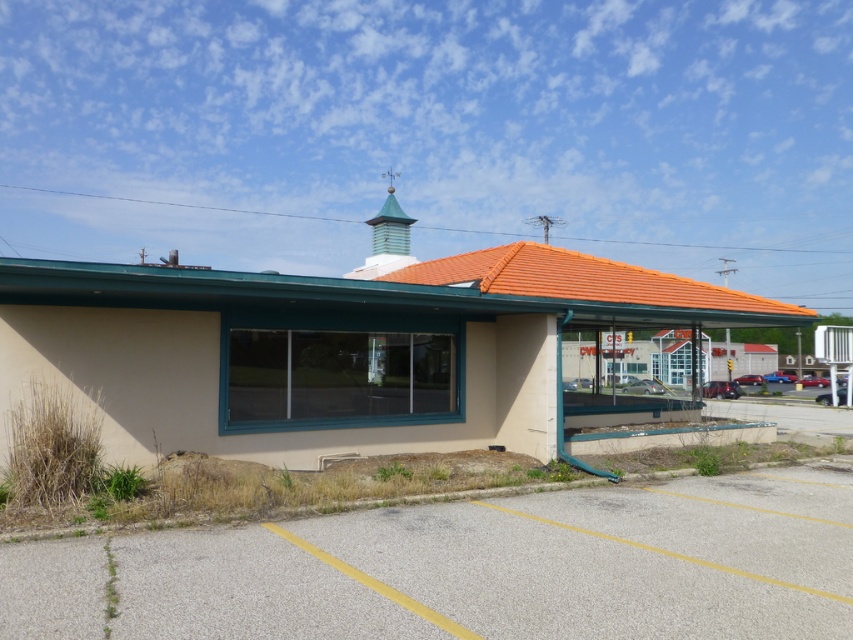
Question: Does metallic red car at lower right appear on the right side of metallic silver sedan at center?

Choices:
 (A) no
 (B) yes

Answer: (B)

Question: Does beige matte building at center have a lesser width compared to metallic red car at lower right?

Choices:
 (A) no
 (B) yes

Answer: (A)

Question: Which object is closer to the camera taking this photo?

Choices:
 (A) gray asphalt parking lot at lower left
 (B) shiny red sedan at center

Answer: (A)

Question: Which point is closer to the camera taking this photo?

Choices:
 (A) (804, 381)
 (B) (648, 381)
 (C) (784, 636)
 (D) (761, 374)

Answer: (C)

Question: Estimate the real-world distances between objects in this image. Which object is farther from the metallic silver sedan at center?

Choices:
 (A) shiny red sedan at center
 (B) metallic red sedan at right
 (C) gray asphalt parking lot at lower left
 (D) metallic blue truck at center-right

Answer: (C)

Question: Is beige matte building at center positioned in front of metallic blue truck at center-right?

Choices:
 (A) yes
 (B) no

Answer: (A)